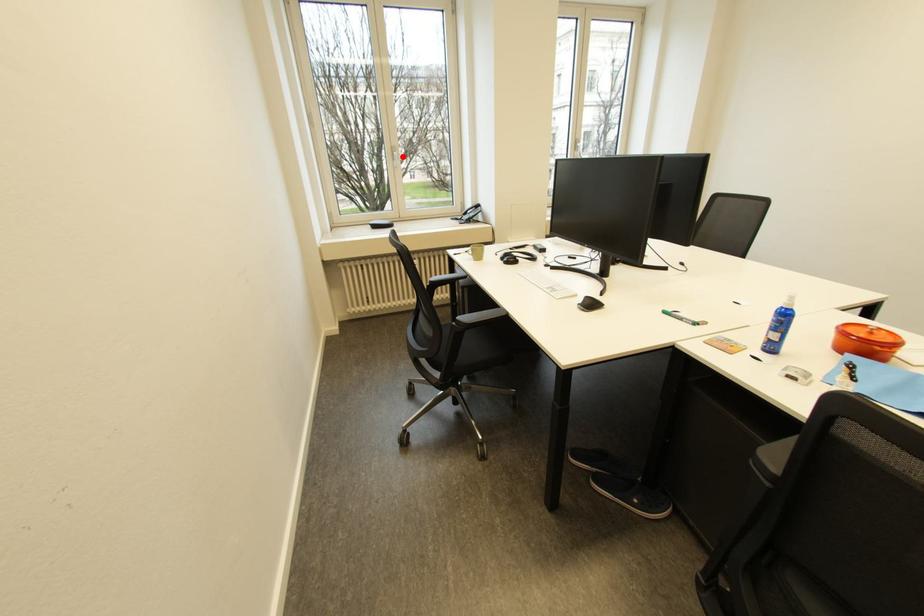
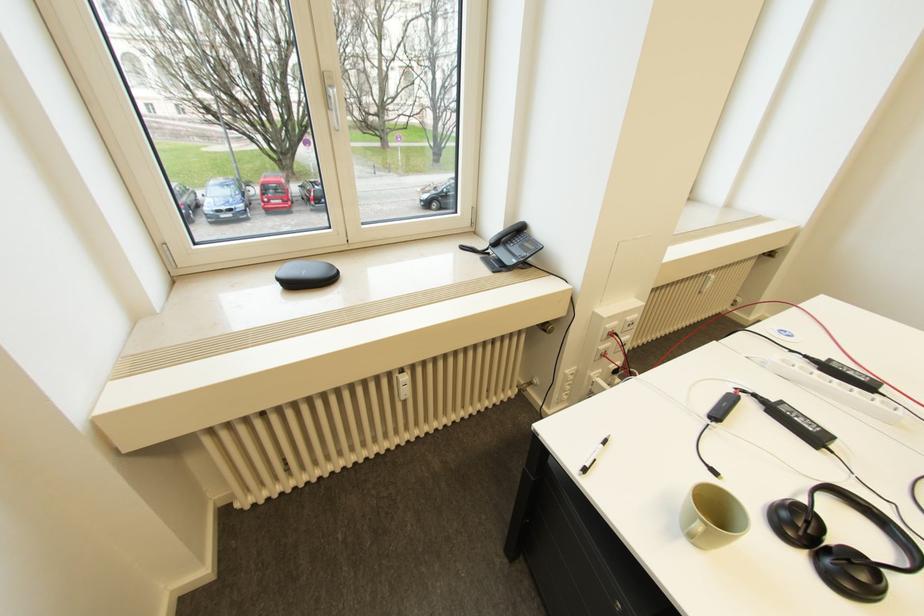
Where in the second image is the point corresponding to the highlighted location from the first image?

(335, 98)